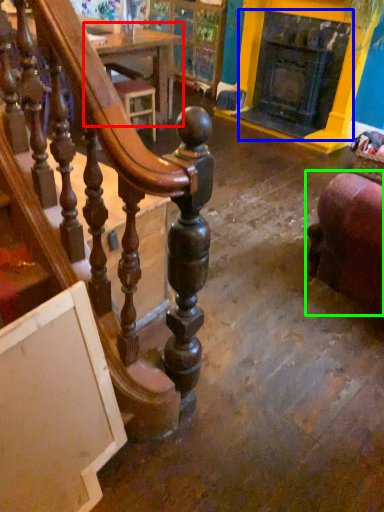
Question: Which is nearer to the table (highlighted by a red box)? fireplace (highlighted by a blue box) or furniture (highlighted by a green box).

Choices:
 (A) fireplace
 (B) furniture

Answer: (A)